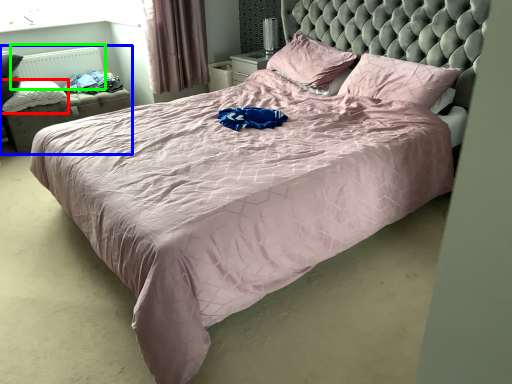
Question: Which object is positioned closest to pillow (highlighted by a red box)? Select from bed frame (highlighted by a blue box) and radiator (highlighted by a green box).

Choices:
 (A) bed frame
 (B) radiator

Answer: (A)